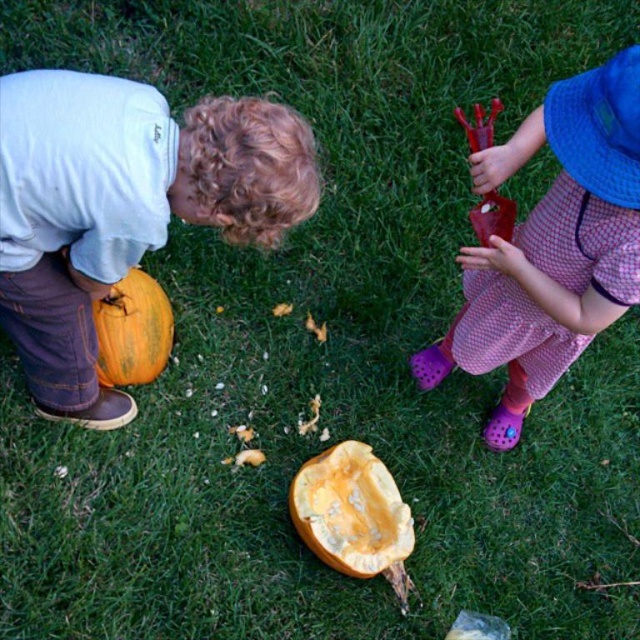
Does matte orange pumpkin at left appear on the right side of yellow matte pumpkin at center?

Incorrect, matte orange pumpkin at left is not on the right side of yellow matte pumpkin at center.

Can you confirm if matte orange pumpkin at left is wider than yellow matte pumpkin at center?

Yes, matte orange pumpkin at left is wider than yellow matte pumpkin at center.

Is point (285, 189) positioned behind point (355, 474)?

No, it is not.

In order to click on matte orange pumpkin at left in this screenshot , I will do `click(124, 208)`.

Is matte orange pumpkin at left to the right of orange matte pumpkin at lower left from the viewer's perspective?

Correct, you'll find matte orange pumpkin at left to the right of orange matte pumpkin at lower left.

Locate an element on the screen. matte orange pumpkin at left is located at coordinates (124, 208).

Is rubberized plastic lobster at right to the left of yellow matte pumpkin at center from the viewer's perspective?

No, rubberized plastic lobster at right is not to the left of yellow matte pumpkin at center.

Identify the location of rubberized plastic lobster at right. (552, 246).

Is point (628, 56) farther from camera compared to point (301, 506)?

No.

Image resolution: width=640 pixels, height=640 pixels. Find the location of `rubberized plastic lobster at right`. rubberized plastic lobster at right is located at coordinates (552, 246).